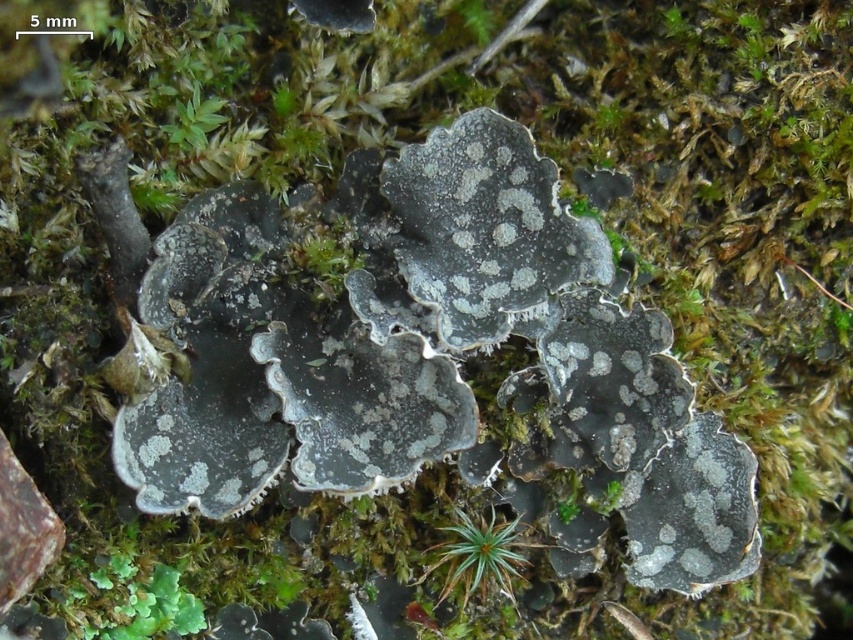
Based on the photo, you are a gardener trying to transplant the green leafy plant at lower left to be closer to the green fuzzy moss at center. How far apart are they currently?

The distance between the green leafy plant at lower left and the green fuzzy moss at center is 16.69 inches.